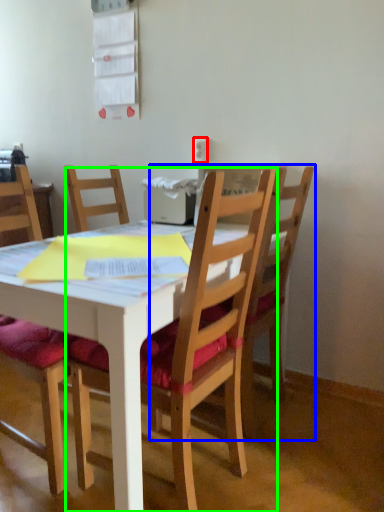
Question: Based on their relative distances, which object is farther from power outlet (highlighted by a red box)? Choose from chair (highlighted by a blue box) and chair (highlighted by a green box).

Choices:
 (A) chair
 (B) chair

Answer: (B)